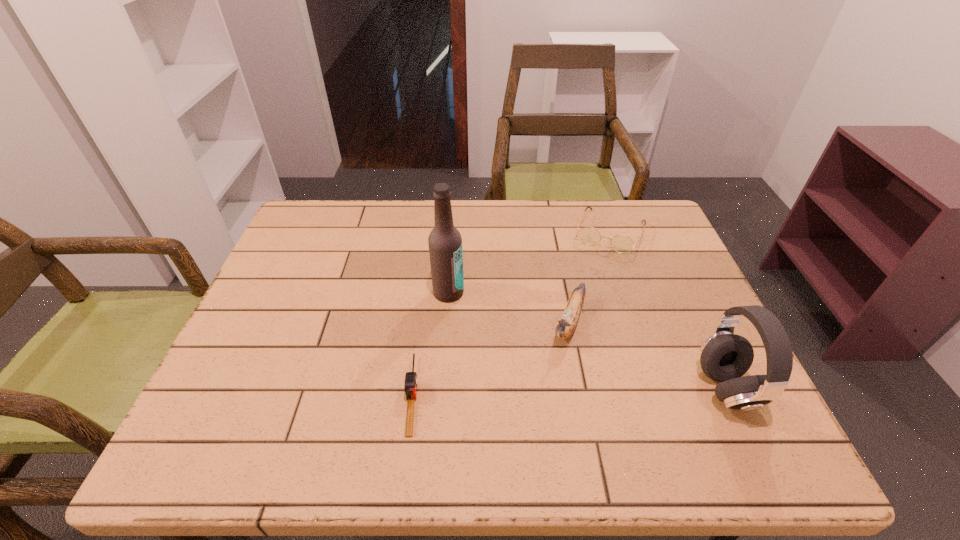
Find the location of a particular element. The height and width of the screenshot is (540, 960). vacant space at the far left corner is located at coordinates (310, 200).

What are the coordinates of `vacant space at the far right corner of the desktop` in the screenshot? It's located at (623, 211).

At what (x,y) coordinates should I click in order to perform the action: click on free space between the shortest object and the third object from left to right. Please return your answer as a coordinate pair (x, y). The image size is (960, 540). Looking at the image, I should click on (491, 359).

The height and width of the screenshot is (540, 960). I want to click on vacant area that lies between the banana and the farthest object, so click(588, 277).

The image size is (960, 540). Find the location of `unoccupied area between the spectacles and the banana`. unoccupied area between the spectacles and the banana is located at coordinates (588, 277).

In order to click on vacant space that is in between the beer bottle and the farthest object in this screenshot , I will do `click(529, 262)`.

The height and width of the screenshot is (540, 960). I want to click on unoccupied area between the shortest object and the spectacles, so click(x=511, y=313).

Where is `vacant space that's between the fourth shortest object and the tallest object`? The height and width of the screenshot is (540, 960). vacant space that's between the fourth shortest object and the tallest object is located at coordinates (588, 341).

What are the coordinates of `free space between the tape measure and the second tallest object` in the screenshot? It's located at (569, 392).

Where is `free area in between the third shortest object and the second object from left to right`? free area in between the third shortest object and the second object from left to right is located at coordinates (508, 307).